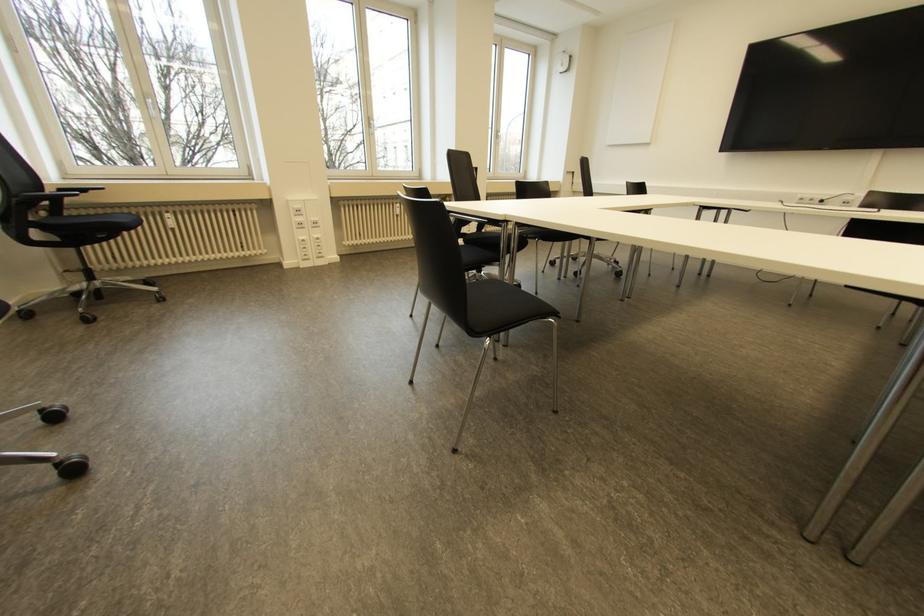
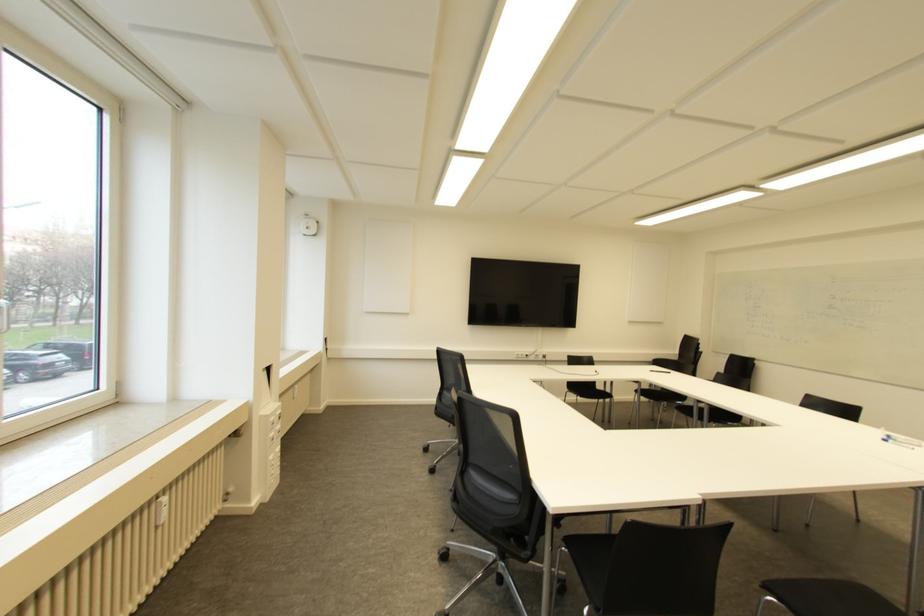
The point at (x=397, y=204) is marked in the first image. Where is the corresponding point in the second image?

(163, 499)